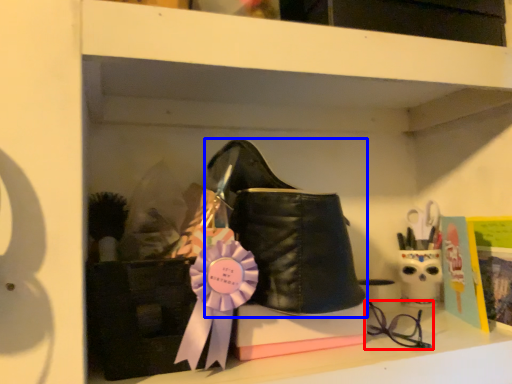
Question: Which point is closer to the camera, glasses (highlighted by a red box) or footwear (highlighted by a blue box)?

Choices:
 (A) glasses
 (B) footwear

Answer: (B)